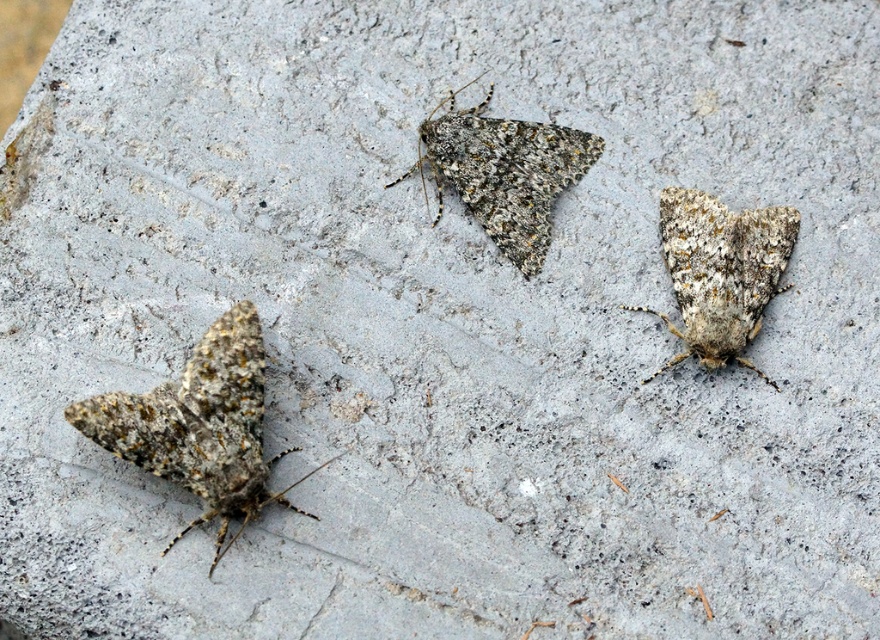
You are a nature photographer trying to capture closeup shots of the speckled brown moth at lower left and the speckled brown moth at right. Since you want to ensure both moths are in focus, you need to know which one is bigger. Which moth is larger?

The speckled brown moth at lower left is larger in size than the speckled brown moth at right.

You are observing two points on a concrete surface where moths are resting. The points are labeled as point (96, 419) and point (577, 141). Which point is nearer to you?

Point (96, 419) is closer to the viewer than point (577, 141).